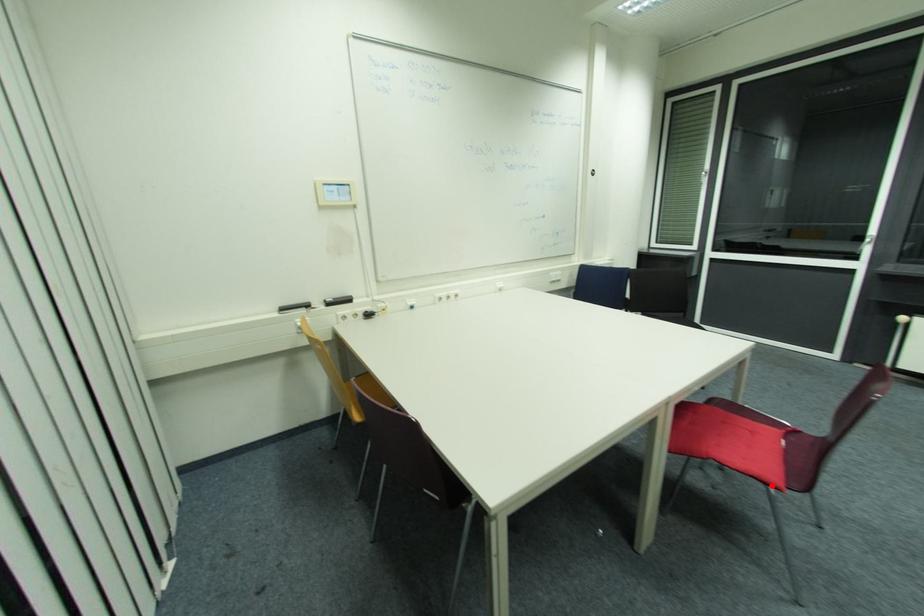
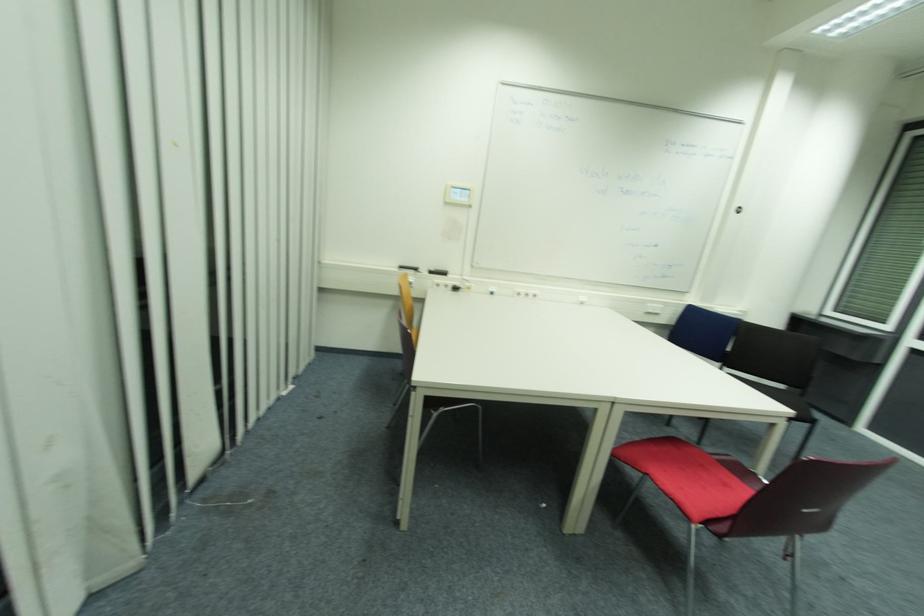
Question: I am providing you with two images of the same scene from different viewpoints. Image1 has a red point marked. In image2, the corresponding 3D location appears at what relative position? Reply with the corresponding letter.

Choices:
 (A) Closer
 (B) Farther

Answer: (B)